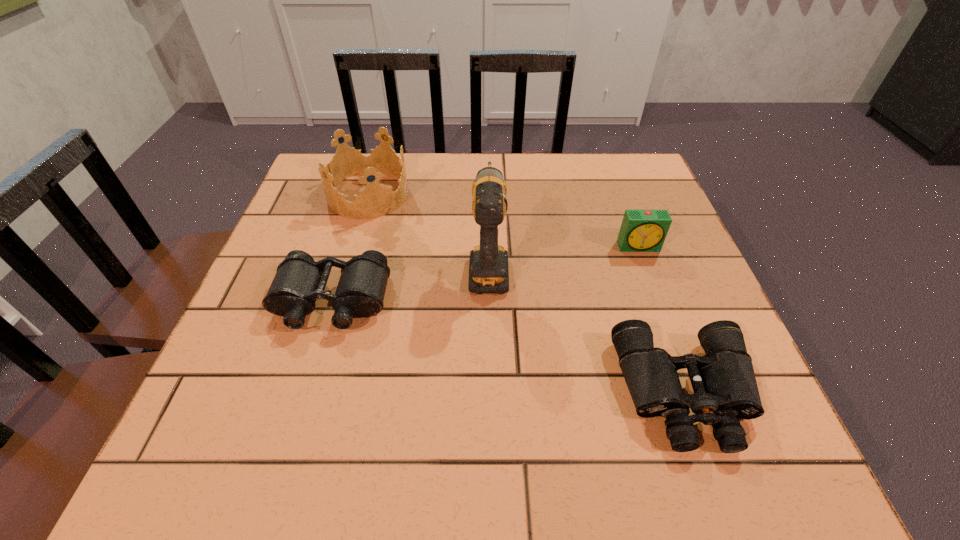
Identify the location of vacant space situated 0.150m with the drill bit of the tallest object facing forward. (488, 199).

Locate an element on the screen. The image size is (960, 540). vacant position located 0.210m on the front-facing side of the farthest object is located at coordinates (489, 194).

What are the coordinates of `vacant region located on the front-facing side of the third tallest object` in the screenshot? It's located at (696, 398).

At what (x,y) coordinates should I click in order to perform the action: click on vacant area situated 0.190m through the eyepieces of the farther binoculars. Please return your answer as a coordinate pair (x, y). This screenshot has width=960, height=540. Looking at the image, I should click on (292, 431).

Locate an element on the screen. object that is positioned at the far edge is located at coordinates [x=375, y=200].

Image resolution: width=960 pixels, height=540 pixels. Identify the location of object that is positioned at the near edge. (725, 389).

The width and height of the screenshot is (960, 540). What are the coordinates of `tiara that is at the left edge` in the screenshot? It's located at (375, 200).

Where is `binoculars that is at the left edge`? Image resolution: width=960 pixels, height=540 pixels. binoculars that is at the left edge is located at coordinates (299, 281).

This screenshot has width=960, height=540. I want to click on alarm clock that is at the right edge, so click(x=641, y=230).

Locate an element on the screen. The image size is (960, 540). binoculars present at the right edge is located at coordinates (725, 389).